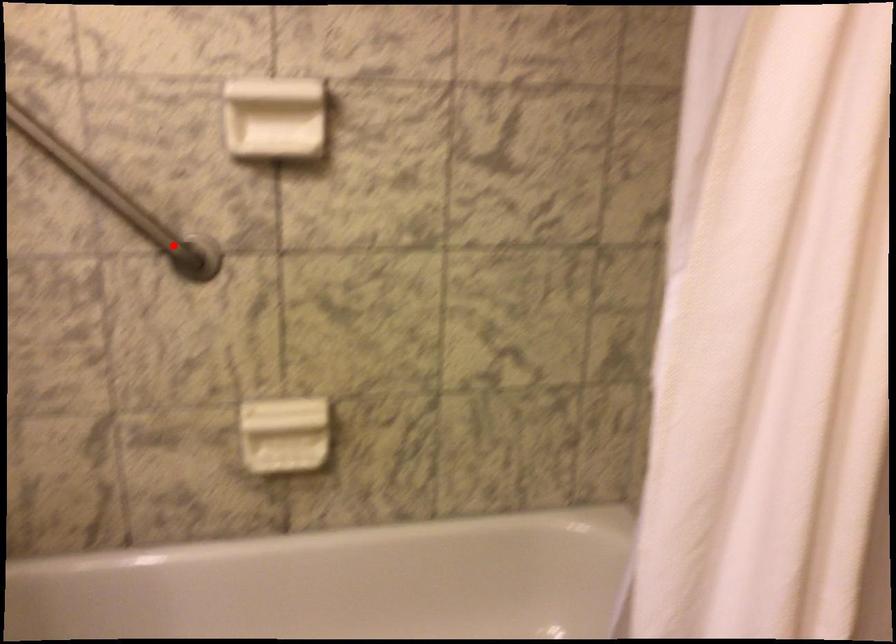
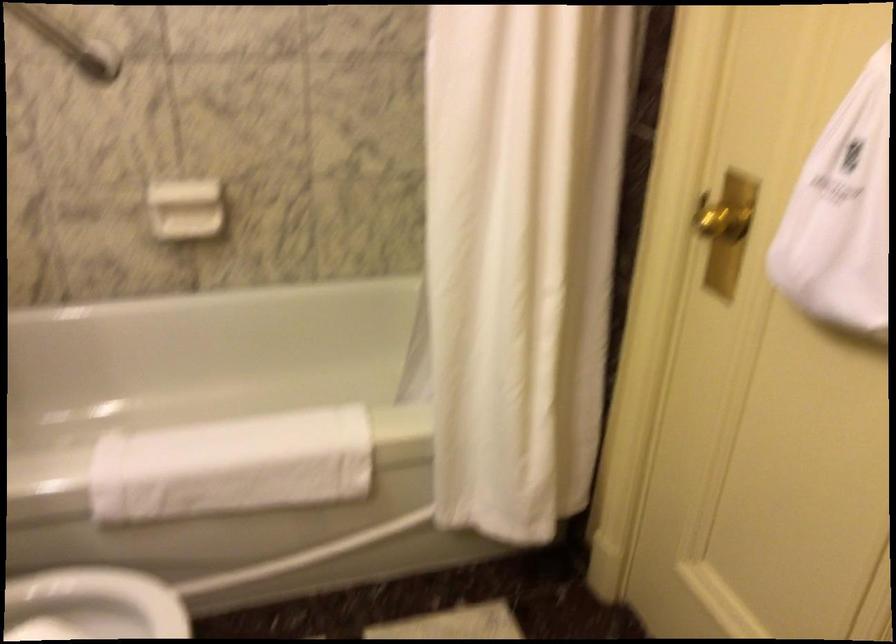
Where in the second image is the point corresponding to the highlighted location from the first image?

(69, 42)